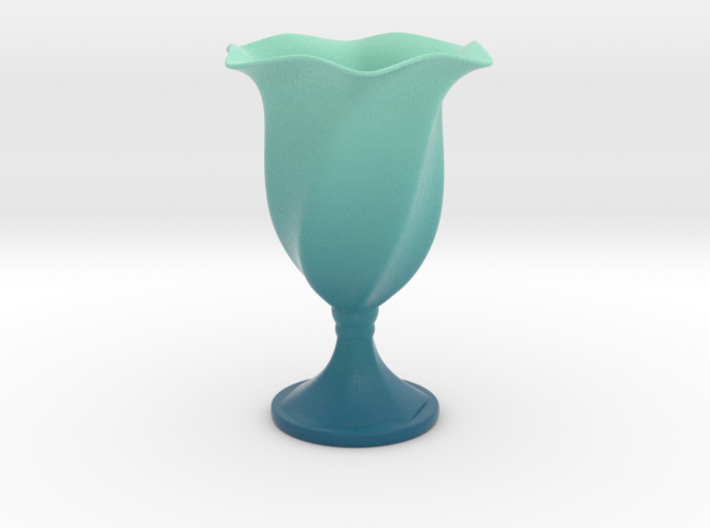
Where is `cup`? Image resolution: width=710 pixels, height=528 pixels. cup is located at coordinates (354, 241).